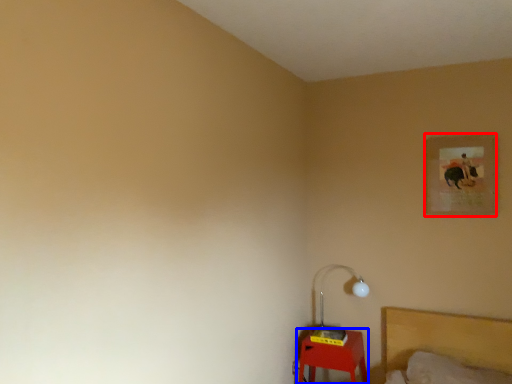
Question: Which object appears farthest to the camera in this image, picture frame (highlighted by a red box) or furniture (highlighted by a blue box)?

Choices:
 (A) picture frame
 (B) furniture

Answer: (B)